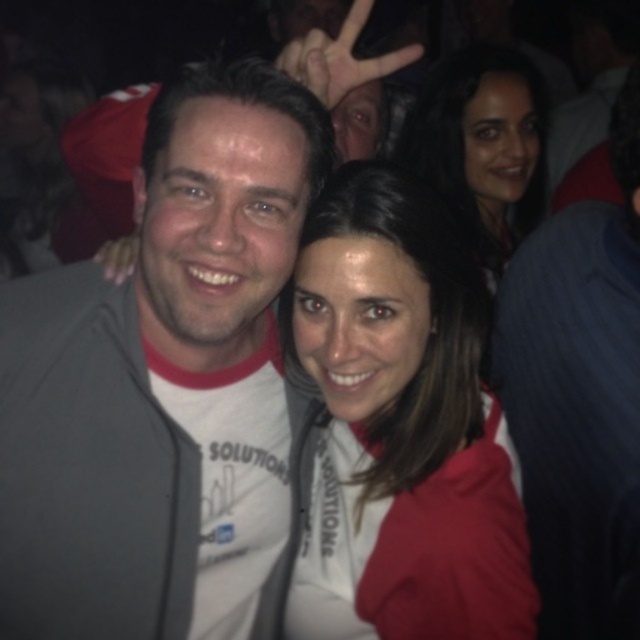
Is point (179, 316) closer to camera compared to point (381, 224)?

Yes.

Between gray fabric jacket at center and matte white hoodie at center, which one has less height?

With less height is matte white hoodie at center.

Does point (118, 296) lie in front of point (323, 545)?

Yes.

This screenshot has width=640, height=640. I want to click on gray fabric jacket at center, so click(164, 385).

Is gray fabric jacket at center behind smooth dark hair at upper right?

No, it is in front of smooth dark hair at upper right.

Describe the element at coordinates (164, 385) in the screenshot. I see `gray fabric jacket at center` at that location.

Identify the location of gray fabric jacket at center. (164, 385).

Which of these two, matte white hoodie at center or smooth dark hair at upper right, stands taller?

matte white hoodie at center is taller.

Is matte white hoodie at center to the left of smooth dark hair at upper right from the viewer's perspective?

Yes, matte white hoodie at center is to the left of smooth dark hair at upper right.

This screenshot has width=640, height=640. I want to click on matte white hoodie at center, so click(401, 426).

Where is `matte white hoodie at center`? matte white hoodie at center is located at coordinates (401, 426).